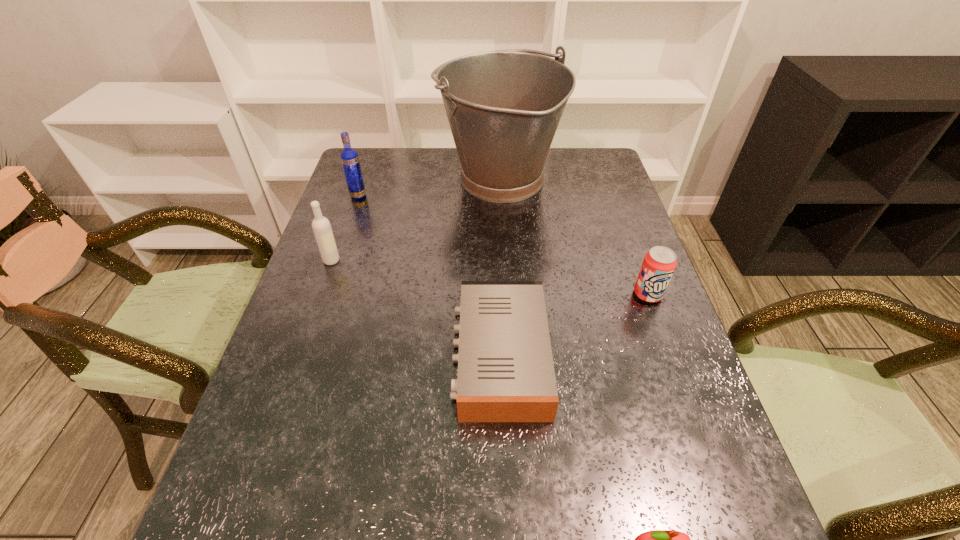
Identify the location of free point between the rightmost object and the bucket. (574, 237).

Locate an element on the screen. The height and width of the screenshot is (540, 960). vacant space that is in between the tallest object and the farther vodka is located at coordinates (429, 188).

Find the location of a particular element. Image resolution: width=960 pixels, height=540 pixels. vacant space in between the farther vodka and the nearer vodka is located at coordinates (345, 228).

Find the location of `blank region between the soda can and the shortest object`. blank region between the soda can and the shortest object is located at coordinates (574, 325).

At what (x,y) coordinates should I click in order to perform the action: click on vacant space that's between the soda can and the farther vodka. Please return your answer as a coordinate pair (x, y). Looking at the image, I should click on (503, 245).

Select which object appears as the third closest to the second shortest object. Please provide its 2D coordinates. Your answer should be formatted as a tuple, i.e. [(x, y)], where the tuple contains the x and y coordinates of a point satisfying the conditions above.

[(503, 107)]

Where is `the third closest object to the tallest object`? This screenshot has width=960, height=540. the third closest object to the tallest object is located at coordinates (658, 266).